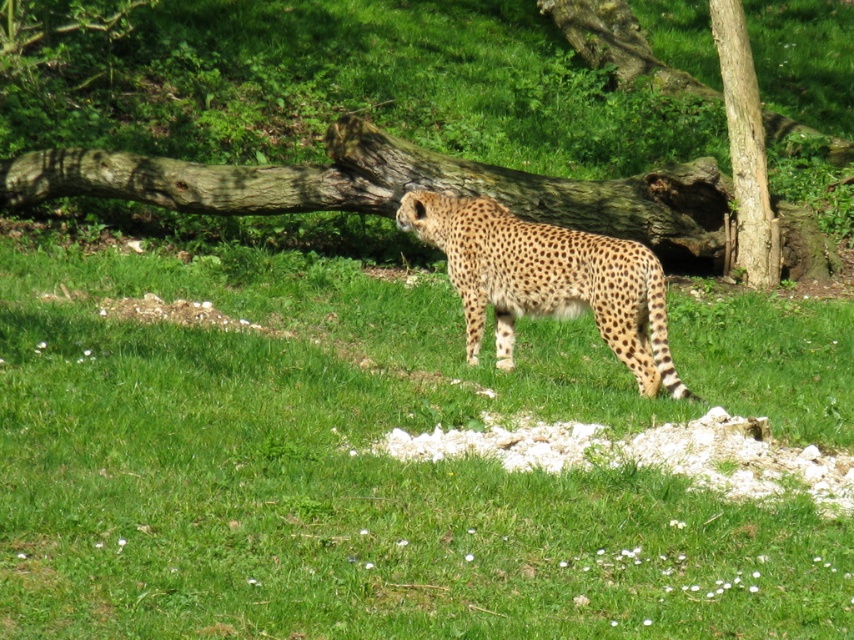
You are a zookeeper standing at the camera position. You need to place a new feeding station exactly 6 meters away from where you are standing. Is the point marked as point (454, 564) in the image within the correct distance for the feeding station?

The point (454, 564) is 5.82 meters away from the camera, which is slightly less than the required 6 meters. Therefore, it is not within the correct distance for the feeding station.